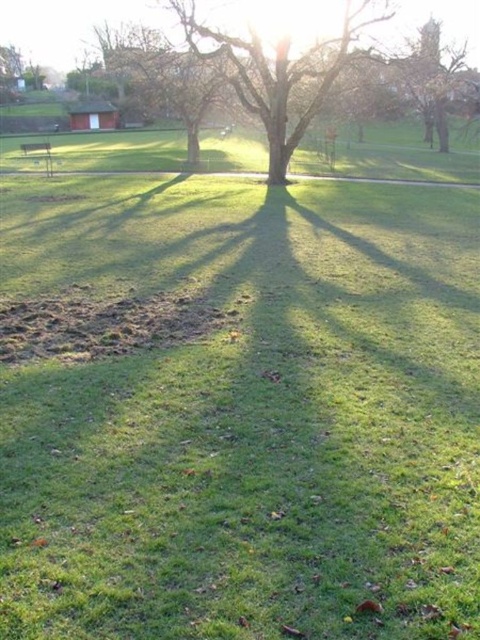
You are a photographer standing in the park and want to take a photo that includes both the smooth brown tree at center and the brown wood tree at upper right. Since you want both trees to be clearly visible in the frame, which tree should you position closer to the camera to ensure they both fit well in the photo?

You should position yourself closer to the smooth brown tree at center because it is already closer to the viewer than the brown wood tree at upper right. This way, both trees will be more equally framed and visible in your photo.

You are standing at the camera position in the park scene. There is a point marked at coordinates point (x=187, y=33). If you want to place a 10 feet wide picnic blanket exactly at that point, will there be enough space around it so that it doesn

The distance of point (x=187, y=33) from camera is 62.00 feet. Since the picnic blanket is only 10 feet wide, there should be sufficient space around the point to accommodate it without any issues.

You are planning to place a picnic blanket between the smooth brown tree at center and the brown wood tree at upper right. Considering their widths, which tree would require more space if you want to keep the blanket equidistant from both?

The brown wood tree at upper right requires more space because it has a greater width than the smooth brown tree at center, so the blanket should be placed closer to the smooth brown tree at center to maintain equal distance.